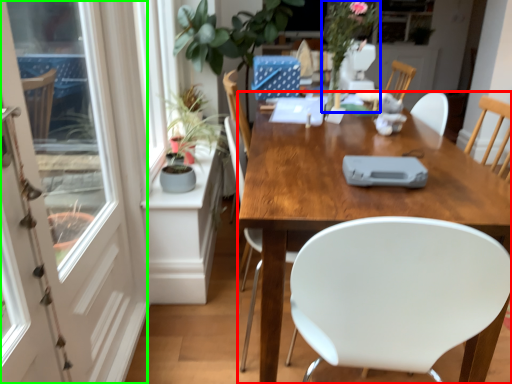
Question: Which object is the farthest from desk (highlighted by a red box)? Choose among these: floral arrangement (highlighted by a blue box) or screen door (highlighted by a green box).

Choices:
 (A) floral arrangement
 (B) screen door

Answer: (B)